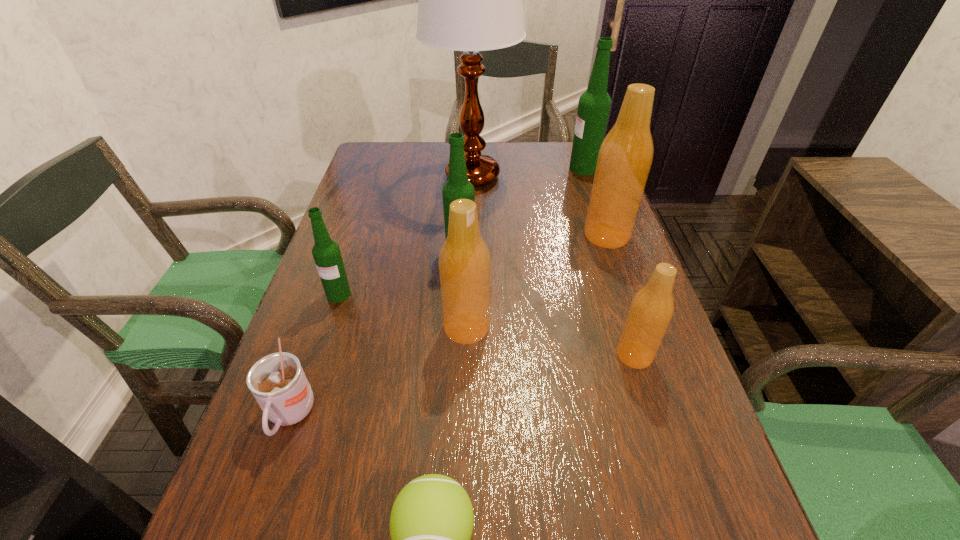
Locate an element on the screen. This screenshot has width=960, height=540. the tallest object is located at coordinates (470, 0).

This screenshot has width=960, height=540. In order to click on white table lamp in this screenshot , I will do `click(470, 0)`.

Where is `the rightmost green beer bottle`? The image size is (960, 540). the rightmost green beer bottle is located at coordinates (594, 105).

Find the location of a particular element. This screenshot has height=540, width=960. the farthest beer bottle is located at coordinates (594, 105).

Find the location of a particular element. the biggest tan beer bottle is located at coordinates (626, 154).

What are the coordinates of `the second smallest green beer bottle` in the screenshot? It's located at (458, 186).

The height and width of the screenshot is (540, 960). Find the location of `the second green beer bottle from right to left`. the second green beer bottle from right to left is located at coordinates (458, 186).

This screenshot has height=540, width=960. What are the coordinates of `the second smallest tan beer bottle` in the screenshot? It's located at (464, 261).

The width and height of the screenshot is (960, 540). Find the location of `the fifth nearest object`. the fifth nearest object is located at coordinates (326, 253).

Locate an element on the screen. This screenshot has width=960, height=540. the leftmost green beer bottle is located at coordinates (326, 253).